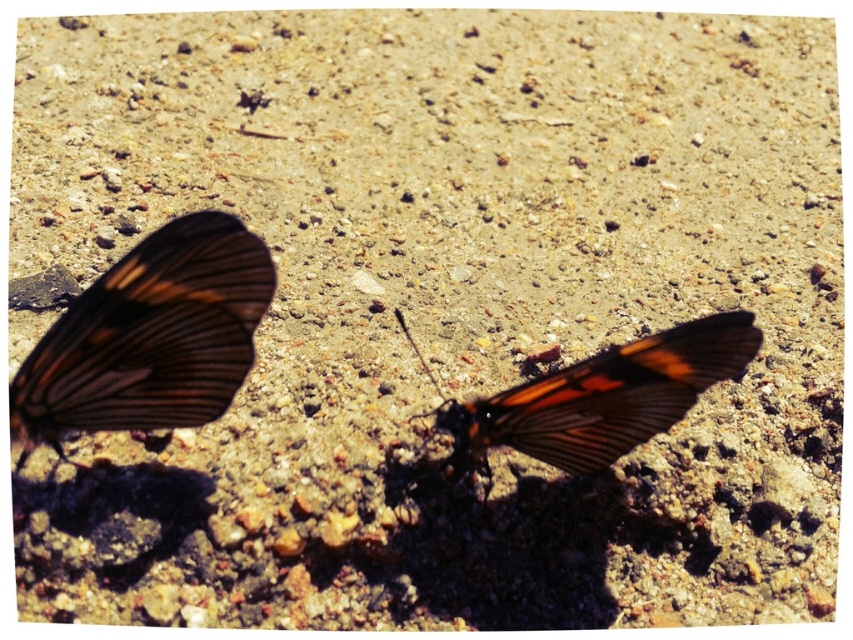
Question: Among these points, which one is farthest from the camera?

Choices:
 (A) (218, 280)
 (B) (547, 435)

Answer: (B)

Question: Which point appears closest to the camera in this image?

Choices:
 (A) (682, 353)
 (B) (16, 436)

Answer: (A)

Question: Is shiny brown butterfly at left positioned in front of orange-patterned wing at center?

Choices:
 (A) no
 (B) yes

Answer: (B)

Question: Is shiny brown butterfly at left thinner than orange-patterned wing at center?

Choices:
 (A) no
 (B) yes

Answer: (B)

Question: Is shiny brown butterfly at left above orange-patterned wing at center?

Choices:
 (A) yes
 (B) no

Answer: (B)